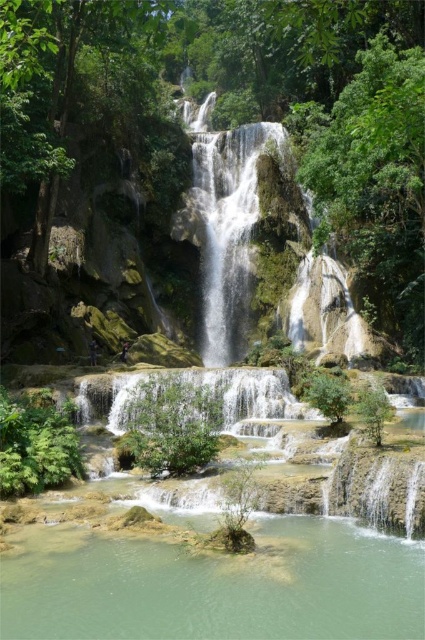
Which is in front, point (183, 515) or point (235, 312)?

Positioned in front is point (183, 515).

Can you confirm if clear water at center is positioned above translucent white water at center?

Actually, clear water at center is below translucent white water at center.

The height and width of the screenshot is (640, 425). What do you see at coordinates (218, 586) in the screenshot?
I see `clear water at center` at bounding box center [218, 586].

Identify the location of clear water at center. The height and width of the screenshot is (640, 425). (218, 586).